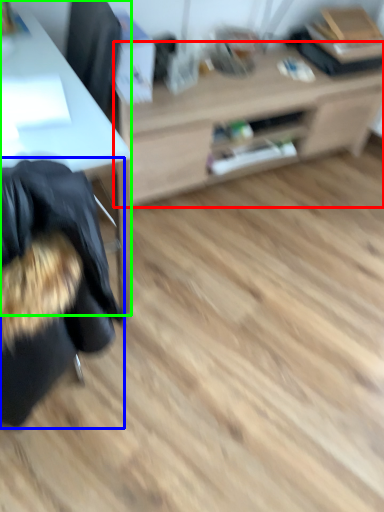
Question: Which object is the farthest from table (highlighted by a red box)? Choose among these: bean bag chair (highlighted by a blue box) or desk (highlighted by a green box).

Choices:
 (A) bean bag chair
 (B) desk

Answer: (A)